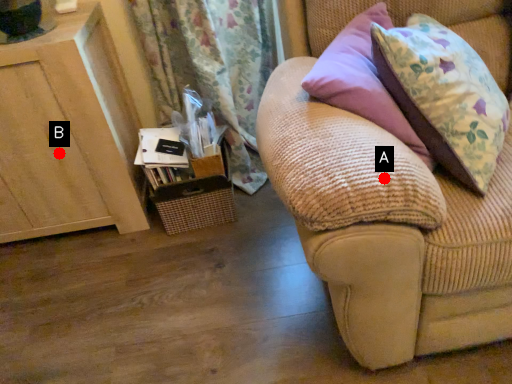
Question: Two points are circled on the image, labeled by A and B beside each circle. Which point appears closest to the camera in this image?

Choices:
 (A) A is closer
 (B) B is closer

Answer: (A)